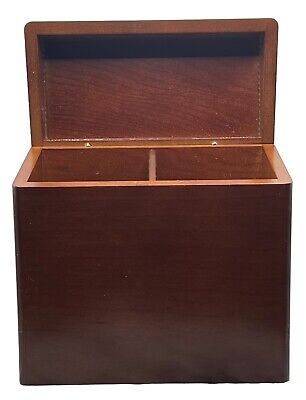
Locate an element on the screen. hinges is located at coordinates [87, 144], [214, 143].